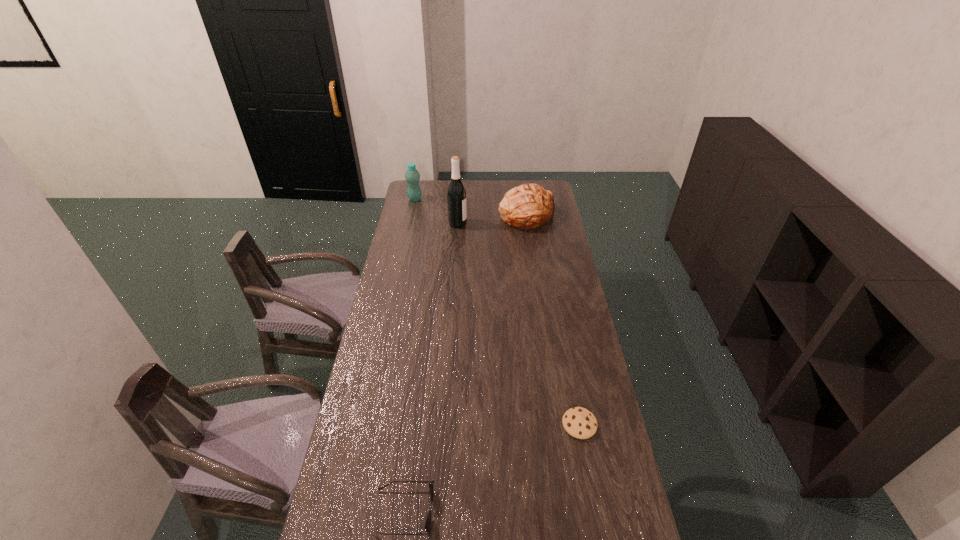
At what (x,y) coordinates should I click in order to perform the action: click on free space that satisfies the following two spatial constraints: 1. on the front side of the cookie; 2. on the left side of the bread. Please return your answer as a coordinate pair (x, y). Looking at the image, I should click on (558, 424).

Image resolution: width=960 pixels, height=540 pixels. Find the location of `vacant space that satisfies the following two spatial constraints: 1. on the label of the fourth farthest object; 2. on the left side of the wine bottle`. vacant space that satisfies the following two spatial constraints: 1. on the label of the fourth farthest object; 2. on the left side of the wine bottle is located at coordinates (444, 424).

Locate an element on the screen. Image resolution: width=960 pixels, height=540 pixels. blank space that satisfies the following two spatial constraints: 1. on the label of the cookie; 2. on the right side of the wine bottle is located at coordinates (444, 424).